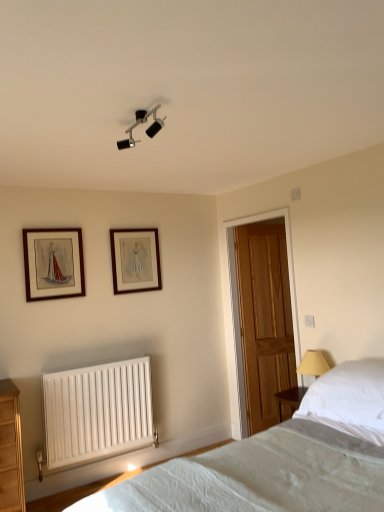
Question: From the image's perspective, is wooden framed picture at upper left, which is the first picture frame in front-to-back order, located beneath white fabric bed at lower right?

Choices:
 (A) no
 (B) yes

Answer: (A)

Question: Considering the relative positions of wooden framed picture at upper left, which is the first picture frame in front-to-back order, and white fabric bed at lower right in the image provided, is wooden framed picture at upper left, which is the first picture frame in front-to-back order, behind white fabric bed at lower right?

Choices:
 (A) no
 (B) yes

Answer: (B)

Question: Does wooden framed picture at upper left, which ranks as the 2th picture frame in right-to-left order, have a greater width compared to white fabric bed at lower right?

Choices:
 (A) yes
 (B) no

Answer: (B)

Question: Is wooden framed picture at upper left, which is counted as the second picture frame, starting from the back, located outside white fabric bed at lower right?

Choices:
 (A) yes
 (B) no

Answer: (A)

Question: Considering the relative positions of wooden framed picture at upper left, the 1th picture frame when ordered from left to right, and white fabric bed at lower right in the image provided, is wooden framed picture at upper left, the 1th picture frame when ordered from left to right, to the right of white fabric bed at lower right from the viewer's perspective?

Choices:
 (A) no
 (B) yes

Answer: (A)

Question: Looking at the image, does wooden picture frame at upper center, which appears as the 1th picture frame when viewed from the back, seem bigger or smaller compared to white soft pillow at right?

Choices:
 (A) big
 (B) small

Answer: (B)

Question: From the image's perspective, relative to white soft pillow at right, is wooden picture frame at upper center, which appears as the 1th picture frame when viewed from the back, above or below?

Choices:
 (A) above
 (B) below

Answer: (A)

Question: Is wooden picture frame at upper center, which appears as the 1th picture frame when viewed from the back, situated inside white soft pillow at right or outside?

Choices:
 (A) outside
 (B) inside

Answer: (A)

Question: In the image, is wooden picture frame at upper center, which is the second picture frame in left-to-right order, on the left side or the right side of white soft pillow at right?

Choices:
 (A) right
 (B) left

Answer: (B)

Question: Do you think wooden door at center is within white soft pillow at right, or outside of it?

Choices:
 (A) inside
 (B) outside

Answer: (B)

Question: Is point (276, 374) closer or farther from the camera than point (340, 402)?

Choices:
 (A) closer
 (B) farther

Answer: (B)

Question: From the image's perspective, is wooden door at center above or below white soft pillow at right?

Choices:
 (A) above
 (B) below

Answer: (A)

Question: Looking at the image, does wooden door at center seem bigger or smaller compared to white soft pillow at right?

Choices:
 (A) big
 (B) small

Answer: (B)

Question: Considering the relative positions of wooden door at center and white fabric bed at lower right in the image provided, is wooden door at center to the left or to the right of white fabric bed at lower right?

Choices:
 (A) left
 (B) right

Answer: (B)

Question: Is point (244, 221) positioned closer to the camera than point (274, 486)?

Choices:
 (A) closer
 (B) farther

Answer: (B)